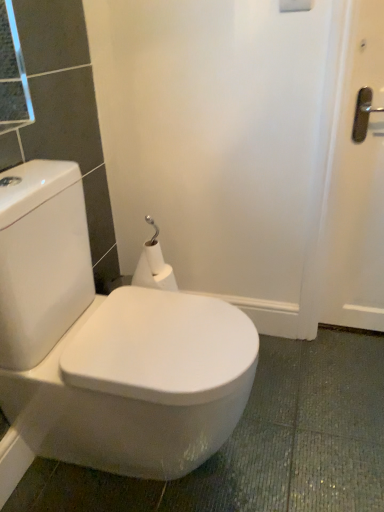
You are a GUI agent. You are given a task and a screenshot of the screen. Output one action in this format:
    pyautogui.click(x=<x>, y=<y>)
    Task: Click on the white matte toilet paper at center
    
    Given the screenshot: What is the action you would take?
    pyautogui.click(x=154, y=269)

Describe the element at coordinates (154, 269) in the screenshot. I see `white matte toilet paper at center` at that location.

What is the approximate height of white matte toilet paper at center?

It is 5.56 inches.

The width and height of the screenshot is (384, 512). Describe the element at coordinates (105, 348) in the screenshot. I see `white glossy toilet at center` at that location.

I want to click on white glossy toilet at center, so click(105, 348).

You are a GUI agent. You are given a task and a screenshot of the screen. Output one action in this format:
    pyautogui.click(x=<x>, y=<y>)
    Task: Click on the white matte toilet paper at center
    This screenshot has width=384, height=512.
    Given the screenshot: What is the action you would take?
    pyautogui.click(x=154, y=269)

Between white matte toilet paper at center and white glossy toilet at center, which one appears on the left side from the viewer's perspective?

white glossy toilet at center.

Is white matte toilet paper at center in front of or behind white glossy toilet at center in the image?

Visually, white matte toilet paper at center is located behind white glossy toilet at center.

Is point (141, 258) closer or farther from the camera than point (209, 392)?

Point (141, 258) is positioned farther from the camera compared to point (209, 392).

From the image's perspective, is white matte toilet paper at center above or below white glossy toilet at center?

From the image's perspective, white matte toilet paper at center appears above white glossy toilet at center.

From a real-world perspective, which object stands above the other?

From a 3D spatial view, white matte toilet paper at center is above.

Can you confirm if white matte toilet paper at center is wider than white glossy toilet at center?

Incorrect, the width of white matte toilet paper at center does not surpass that of white glossy toilet at center.

Who is shorter, white matte toilet paper at center or white glossy toilet at center?

white matte toilet paper at center.

Between white matte toilet paper at center and white glossy toilet at center, which one has smaller size?

→ Smaller between the two is white matte toilet paper at center.

Would you say white matte toilet paper at center is outside white glossy toilet at center?

white matte toilet paper at center lies outside white glossy toilet at center's area.

Is white matte toilet paper at center far away from white glossy toilet at center?

No.

Is white matte toilet paper at center positioned with its back to white glossy toilet at center?

No, white matte toilet paper at center is not facing the opposite direction of white glossy toilet at center.

Can you tell me how much white matte toilet paper at center and white glossy toilet at center differ in facing direction?

They differ by 89.9 degrees in their facing directions.

Measure the distance between white matte toilet paper at center and white glossy toilet at center.

white matte toilet paper at center is 14.20 inches from white glossy toilet at center.

Locate an element on the screen. The width and height of the screenshot is (384, 512). toilet paper behind the white glossy toilet at center is located at coordinates (154, 269).

Which object is positioned more to the right, white glossy toilet at center or white matte toilet paper at center?

white matte toilet paper at center is more to the right.

Which object is closer to the camera taking this photo, white glossy toilet at center or white matte toilet paper at center?

white glossy toilet at center.

Which is behind, point (144, 421) or point (160, 286)?

The point (160, 286) is farther from the camera.

From the image's perspective, is white glossy toilet at center under white matte toilet paper at center?

Yes, from the image's perspective, white glossy toilet at center is beneath white matte toilet paper at center.

From a real-world perspective, is white glossy toilet at center below white matte toilet paper at center?

Yes, from a real-world perspective, white glossy toilet at center is beneath white matte toilet paper at center.

In terms of width, does white glossy toilet at center look wider or thinner when compared to white matte toilet paper at center?

white glossy toilet at center is wider than white matte toilet paper at center.

Does white glossy toilet at center have a greater height compared to white matte toilet paper at center?

Yes.

Is white glossy toilet at center smaller than white matte toilet paper at center?

Actually, white glossy toilet at center might be larger than white matte toilet paper at center.

Is white glossy toilet at center completely or partially outside of white matte toilet paper at center?

That's correct, white glossy toilet at center is outside of white matte toilet paper at center.

Are white glossy toilet at center and white matte toilet paper at center beside each other?

No, white glossy toilet at center is not in contact with white matte toilet paper at center.

Is white glossy toilet at center facing towards white matte toilet paper at center?

No.

The image size is (384, 512). Find the location of `toilet that is under the white matte toilet paper at center (from a real-world perspective)`. toilet that is under the white matte toilet paper at center (from a real-world perspective) is located at coordinates (105, 348).

At what (x,y) coordinates should I click in order to perform the action: click on toilet paper behind the white glossy toilet at center. Please return your answer as a coordinate pair (x, y). The height and width of the screenshot is (512, 384). Looking at the image, I should click on (154, 269).

Locate an element on the screen. The height and width of the screenshot is (512, 384). toilet that is below the white matte toilet paper at center (from the image's perspective) is located at coordinates (105, 348).